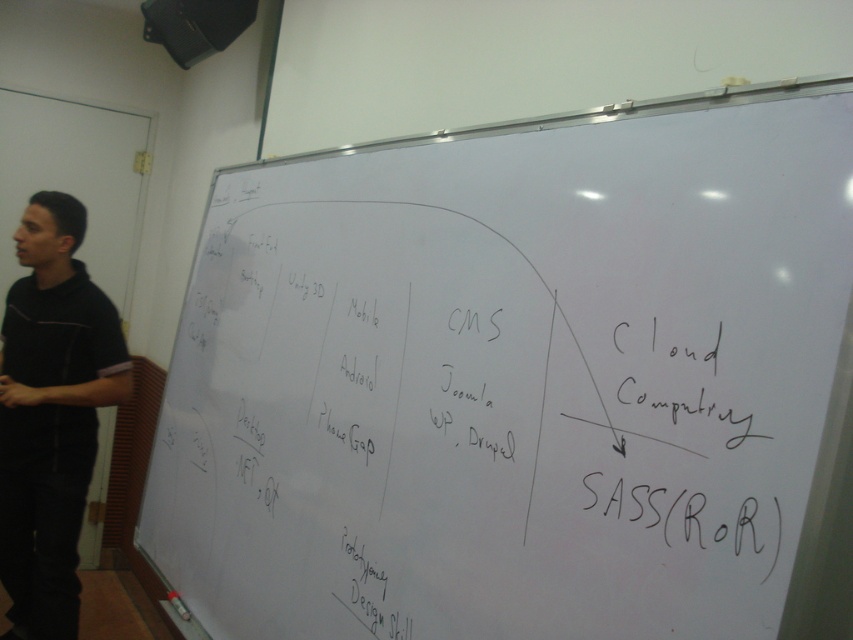
Question: Which point appears farthest from the camera in this image?

Choices:
 (A) (19, 365)
 (B) (593, 554)

Answer: (A)

Question: Observing the image, what is the correct spatial positioning of white matte board at center in reference to black fabric shirt at left?

Choices:
 (A) right
 (B) left

Answer: (A)

Question: Which of the following is the closest to the observer?

Choices:
 (A) (28, 541)
 (B) (305, 180)

Answer: (B)

Question: Does white matte board at center have a lesser width compared to black fabric shirt at left?

Choices:
 (A) yes
 (B) no

Answer: (B)

Question: Among these points, which one is farthest from the camera?

Choices:
 (A) (519, 326)
 (B) (9, 632)

Answer: (B)

Question: Does white matte board at center appear on the right side of black fabric shirt at left?

Choices:
 (A) yes
 (B) no

Answer: (A)